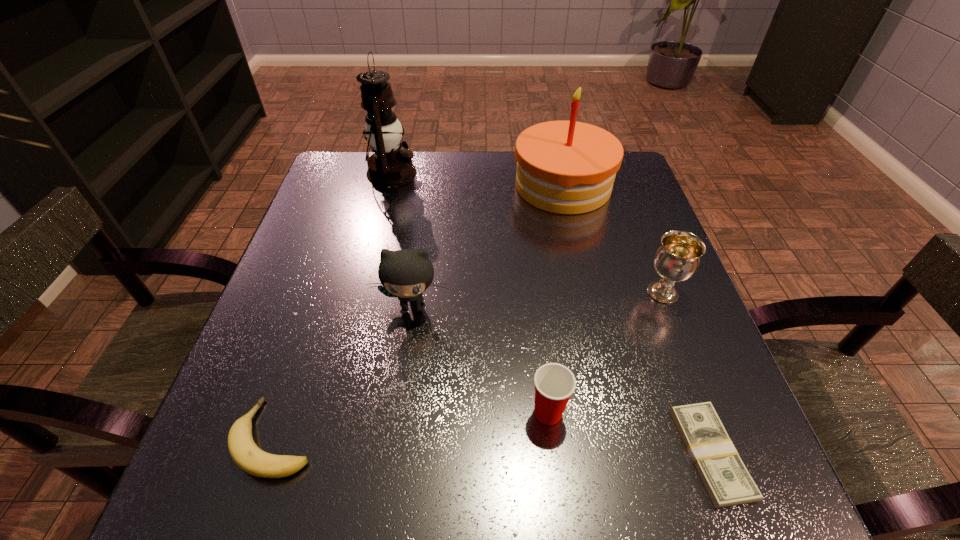
What are the coordinates of `birthday cake that is at the right edge` in the screenshot? It's located at (566, 167).

Locate an element on the screen. The image size is (960, 540). chalice at the right edge is located at coordinates (677, 259).

Identify the location of dollar situated at the right edge. (725, 477).

Find the location of a particular element. Image resolution: width=960 pixels, height=540 pixels. object at the far left corner is located at coordinates (389, 166).

This screenshot has height=540, width=960. Find the location of `object at the near left corner`. object at the near left corner is located at coordinates (245, 453).

This screenshot has height=540, width=960. Identify the location of object at the far right corner. (566, 167).

Identify the location of object at the near right corner. The width and height of the screenshot is (960, 540). (725, 477).

Locate an element on the screen. This screenshot has width=960, height=540. vacant region at the far edge of the desktop is located at coordinates (447, 189).

In the image, there is a desktop. Identify the location of vacant space at the near edge. The width and height of the screenshot is (960, 540). (581, 473).

This screenshot has height=540, width=960. In order to click on free space at the left edge of the desktop in this screenshot , I will do `click(309, 305)`.